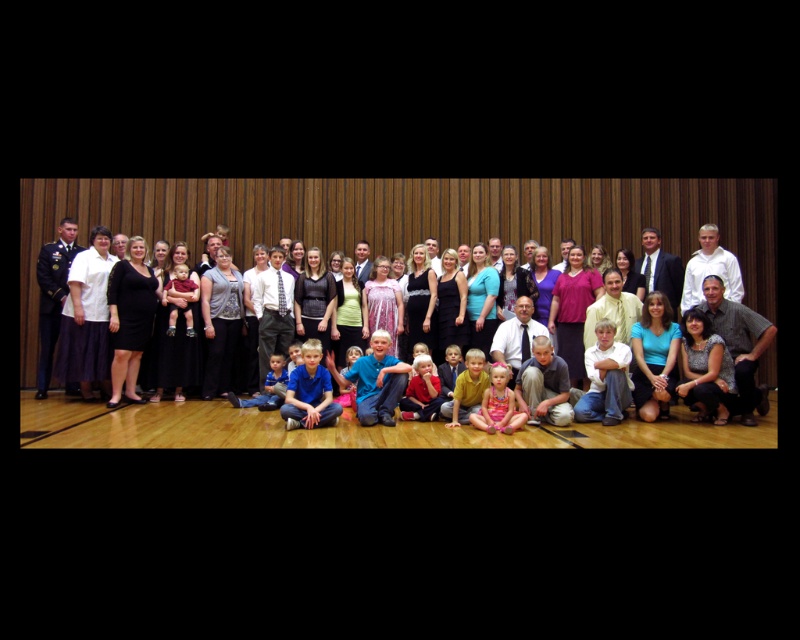
Question: Which object is closer to the camera taking this photo?

Choices:
 (A) matte black dress at center
 (B) dark blue uniform at left
 (C) white shirt at center
 (D) matte black suit at center

Answer: (A)

Question: Which point is farther from the camera taking this photo?

Choices:
 (A) (52, 280)
 (B) (678, 280)
 (C) (706, 241)

Answer: (B)

Question: Can you confirm if matte black dress at center is thinner than white shirt at center?

Choices:
 (A) no
 (B) yes

Answer: (A)

Question: Is matte black dress at center to the right of matte black suit at center from the viewer's perspective?

Choices:
 (A) no
 (B) yes

Answer: (A)

Question: Among these objects, which one is farthest from the camera?

Choices:
 (A) matte black dress at center
 (B) dark blue uniform at left

Answer: (B)

Question: Can you confirm if dark blue uniform at left is positioned above matte black suit at center?

Choices:
 (A) no
 (B) yes

Answer: (A)